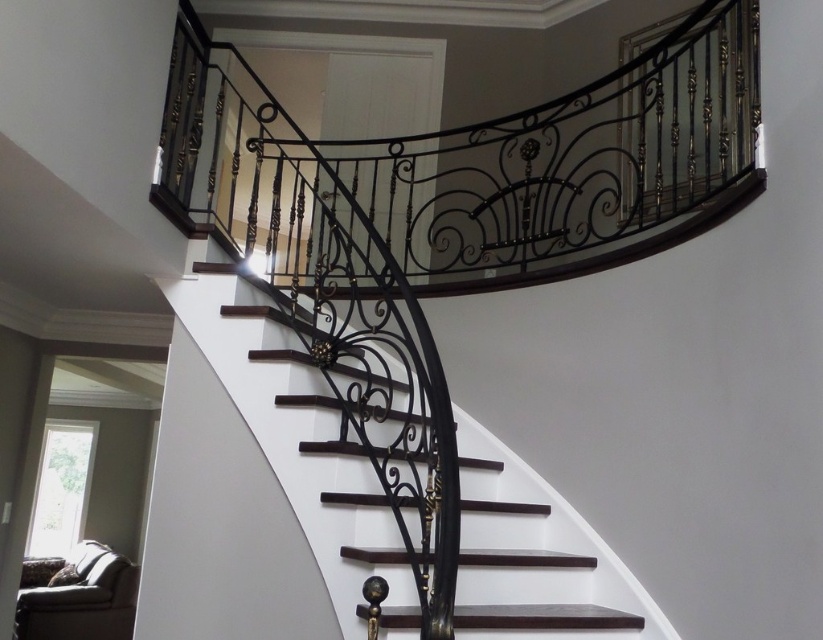
Between black wrought iron balustrade at upper center and dark wood stairs at center, which one appears on the right side from the viewer's perspective?

dark wood stairs at center is more to the right.

Which of these two, black wrought iron balustrade at upper center or dark wood stairs at center, stands shorter?

black wrought iron balustrade at upper center is shorter.

At what (x,y) coordinates should I click in order to perform the action: click on black wrought iron balustrade at upper center. Please return your answer as a coordinate pair (x, y). Looking at the image, I should click on (477, 164).